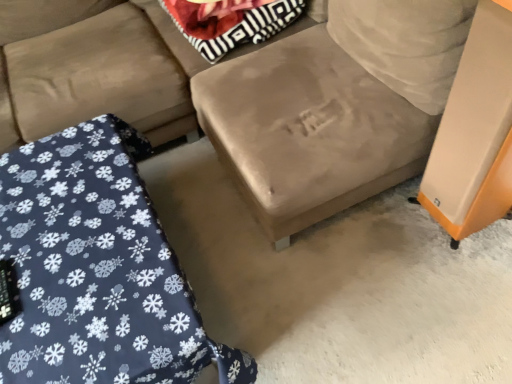
Question: Is orange matte speaker at right to the right of striped fabric pillow at upper center from the viewer's perspective?

Choices:
 (A) no
 (B) yes

Answer: (B)

Question: From a real-world perspective, is orange matte speaker at right below striped fabric pillow at upper center?

Choices:
 (A) yes
 (B) no

Answer: (A)

Question: Is striped fabric pillow at upper center inside orange matte speaker at right?

Choices:
 (A) yes
 (B) no

Answer: (B)

Question: Can you confirm if orange matte speaker at right is wider than striped fabric pillow at upper center?

Choices:
 (A) yes
 (B) no

Answer: (B)

Question: Considering the relative sizes of orange matte speaker at right and striped fabric pillow at upper center in the image provided, is orange matte speaker at right smaller than striped fabric pillow at upper center?

Choices:
 (A) yes
 (B) no

Answer: (A)

Question: Is velvet blue blanket at lower left bigger or smaller than orange matte speaker at right?

Choices:
 (A) small
 (B) big

Answer: (B)

Question: Is velvet blue blanket at lower left taller or shorter than orange matte speaker at right?

Choices:
 (A) tall
 (B) short

Answer: (B)

Question: From the image's perspective, is velvet blue blanket at lower left above or below orange matte speaker at right?

Choices:
 (A) below
 (B) above

Answer: (B)

Question: From a real-world perspective, is velvet blue blanket at lower left physically located above or below orange matte speaker at right?

Choices:
 (A) below
 (B) above

Answer: (A)

Question: Is velvet blue blanket at lower left wider or thinner than suede-like beige couch at center?

Choices:
 (A) thin
 (B) wide

Answer: (A)

Question: Visually, is velvet blue blanket at lower left positioned to the left or to the right of suede-like beige couch at center?

Choices:
 (A) left
 (B) right

Answer: (A)

Question: From a real-world perspective, relative to suede-like beige couch at center, is velvet blue blanket at lower left vertically above or below?

Choices:
 (A) above
 (B) below

Answer: (B)

Question: From the image's perspective, is velvet blue blanket at lower left positioned above or below suede-like beige couch at center?

Choices:
 (A) below
 (B) above

Answer: (A)

Question: From the image's perspective, is striped fabric pillow at upper center located above or below orange matte speaker at right?

Choices:
 (A) below
 (B) above

Answer: (B)

Question: Based on their sizes in the image, would you say striped fabric pillow at upper center is bigger or smaller than orange matte speaker at right?

Choices:
 (A) big
 (B) small

Answer: (A)